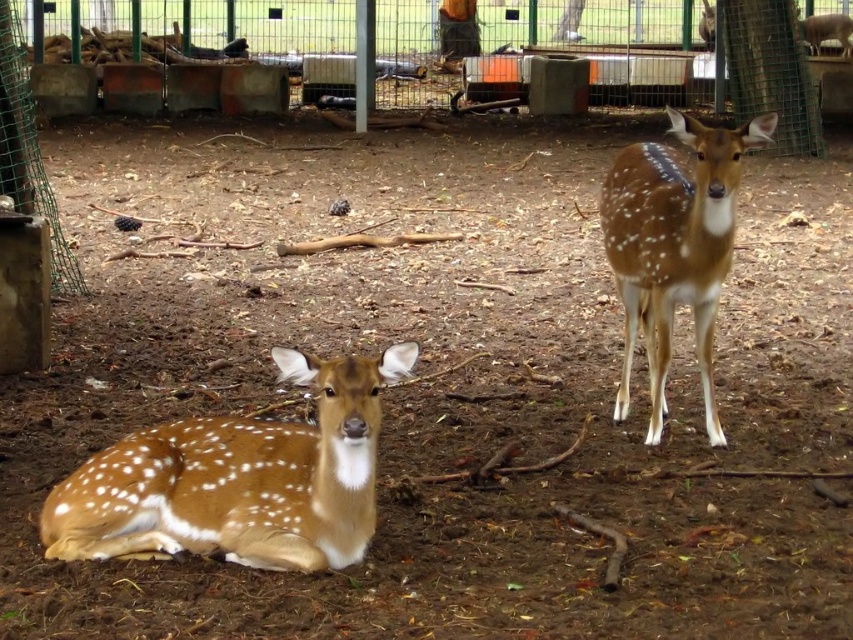
From the picture: Who is positioned more to the right, brown speckled fur at lower left or brown spotted fur at right?

Positioned to the right is brown spotted fur at right.

Is point (329, 561) positioned behind point (711, 275)?

No, (329, 561) is in front of (711, 275).

Find the location of a particular element. The width and height of the screenshot is (853, 640). brown speckled fur at lower left is located at coordinates (238, 480).